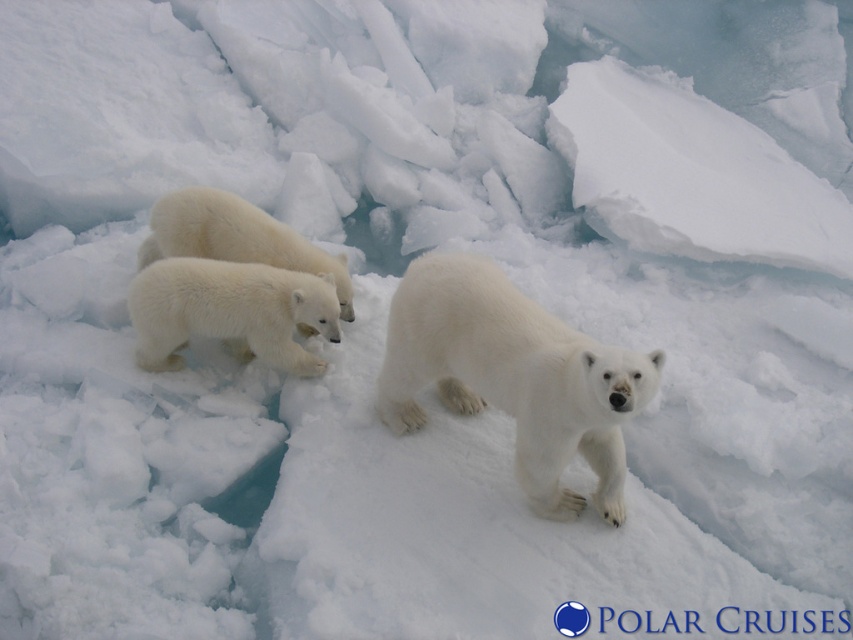
Question: From the image, what is the correct spatial relationship of white fluffy bear cub at left in relation to white fluffy bear at center?

Choices:
 (A) above
 (B) below

Answer: (B)

Question: Does white fluffy bear cub at left come in front of white fluffy bear at center?

Choices:
 (A) no
 (B) yes

Answer: (B)

Question: Based on their relative distances, which object is farther from the white fluffy bear at center?

Choices:
 (A) white fluffy bear cub at left
 (B) white fur bear at center

Answer: (B)

Question: Which is farther from the white fluffy bear cub at left?

Choices:
 (A) white fluffy bear at center
 (B) white fur bear at center

Answer: (B)

Question: Does white fur bear at center appear on the left side of white fluffy bear cub at left?

Choices:
 (A) yes
 (B) no

Answer: (B)

Question: Considering the real-world distances, which object is farthest from the white fluffy bear at center?

Choices:
 (A) white fluffy bear cub at left
 (B) white fur bear at center

Answer: (B)